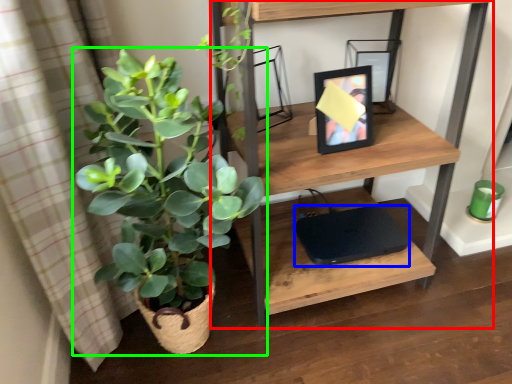
Question: Based on their relative distances, which object is nearer to shelf (highlighted by a red box)? Choose from computer (highlighted by a blue box) and houseplant (highlighted by a green box).

Choices:
 (A) computer
 (B) houseplant

Answer: (B)